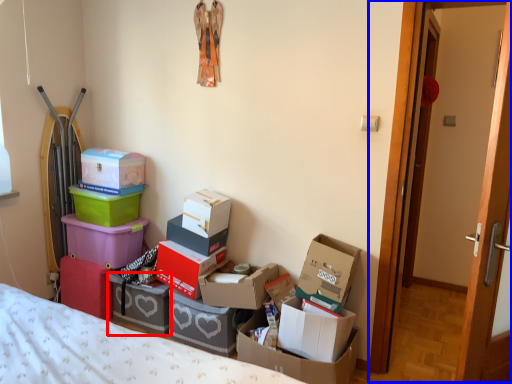
Question: Among these objects, which one is nearest to the camera, box (highlighted by a red box) or door (highlighted by a blue box)?

Choices:
 (A) box
 (B) door

Answer: (B)